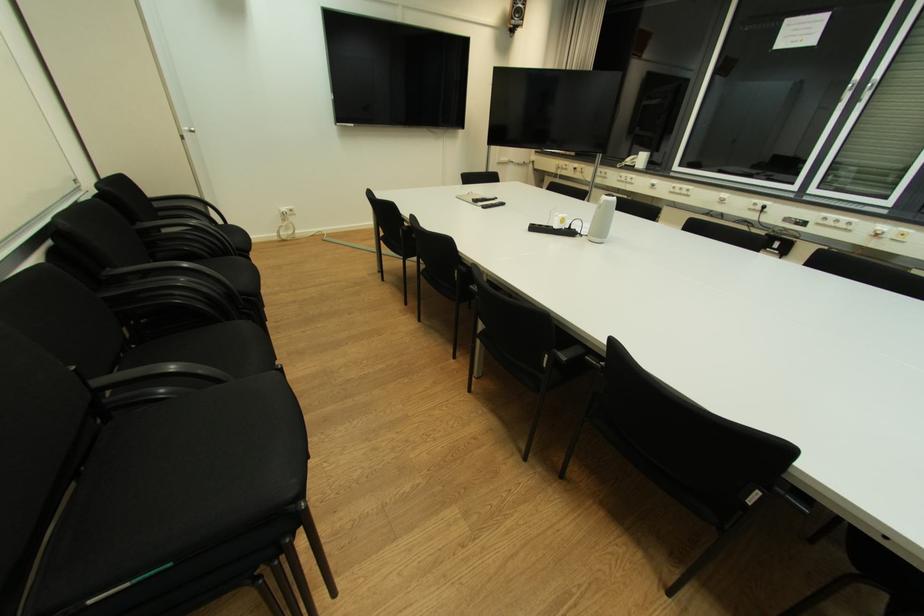
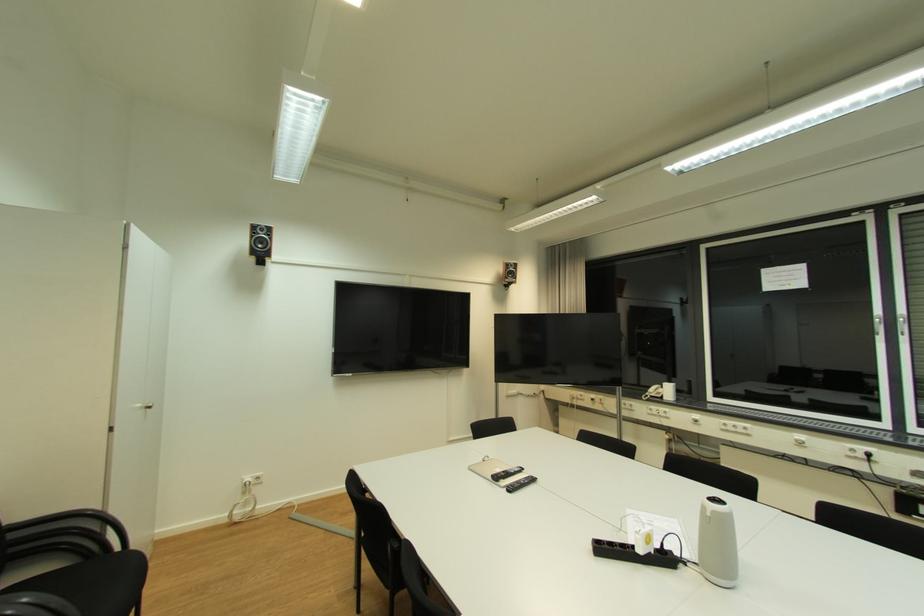
In the second image, find the point that corresponds to the point at 481,201 in the first image.

(502, 479)